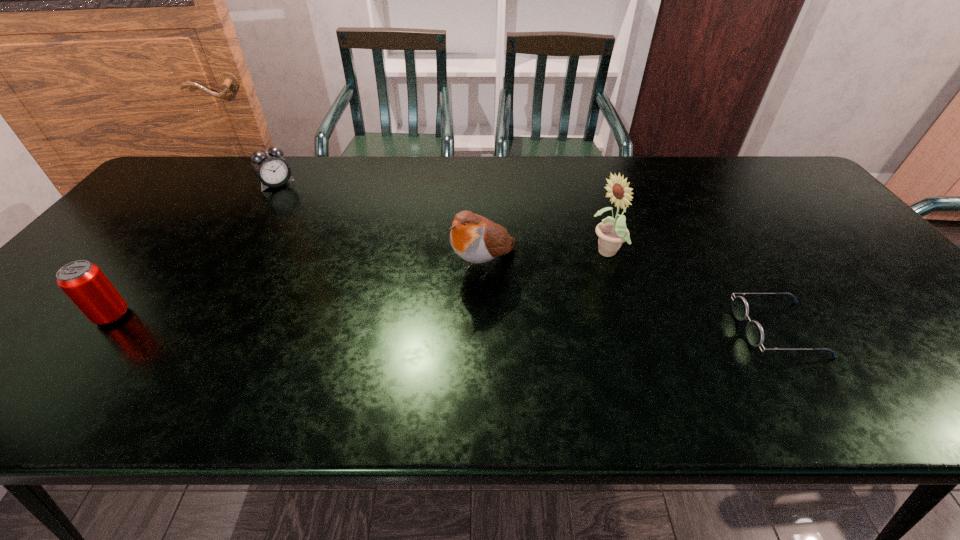
Identify the location of can. This screenshot has width=960, height=540. (84, 283).

Identify the location of the leftmost object. Image resolution: width=960 pixels, height=540 pixels. (84, 283).

At what (x,y) coordinates should I click in order to perform the action: click on sunglasses. Please return your answer as a coordinate pair (x, y). Looking at the image, I should click on (754, 331).

Where is `the rightmost object`? The height and width of the screenshot is (540, 960). the rightmost object is located at coordinates (754, 331).

The height and width of the screenshot is (540, 960). What are the coordinates of `the tallest object` in the screenshot? It's located at (612, 232).

Find the location of a particular element. the fourth object from left to right is located at coordinates (612, 232).

Identify the location of alarm clock. Image resolution: width=960 pixels, height=540 pixels. (269, 166).

Where is `the fourth object from right to left`? The height and width of the screenshot is (540, 960). the fourth object from right to left is located at coordinates (269, 166).

Where is `the third object from right to left`? The height and width of the screenshot is (540, 960). the third object from right to left is located at coordinates (476, 239).

At what (x,y) coordinates should I click in order to perform the action: click on bird. Please return your answer as a coordinate pair (x, y). Image resolution: width=960 pixels, height=540 pixels. Looking at the image, I should click on (476, 239).